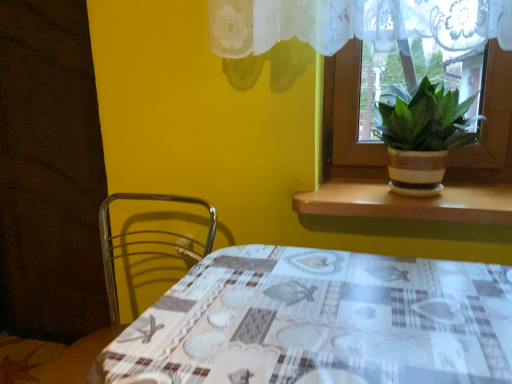
Question: Considering the relative sizes of metallic wire chair at lower left and brown wood at upper right in the image provided, is metallic wire chair at lower left taller than brown wood at upper right?

Choices:
 (A) yes
 (B) no

Answer: (A)

Question: Considering the relative positions of metallic wire chair at lower left and brown wood at upper right in the image provided, is metallic wire chair at lower left to the right of brown wood at upper right from the viewer's perspective?

Choices:
 (A) no
 (B) yes

Answer: (A)

Question: Is metallic wire chair at lower left facing away from brown wood at upper right?

Choices:
 (A) no
 (B) yes

Answer: (A)

Question: From the image's perspective, is metallic wire chair at lower left below brown wood at upper right?

Choices:
 (A) no
 (B) yes

Answer: (B)

Question: Is metallic wire chair at lower left facing towards brown wood at upper right?

Choices:
 (A) yes
 (B) no

Answer: (B)

Question: Does metallic wire chair at lower left come in front of brown wood at upper right?

Choices:
 (A) no
 (B) yes

Answer: (B)

Question: Does brown wood at upper right have a greater height compared to plaid fabric table at center?

Choices:
 (A) yes
 (B) no

Answer: (B)

Question: Considering the relative positions of brown wood at upper right and plaid fabric table at center in the image provided, is brown wood at upper right in front of plaid fabric table at center?

Choices:
 (A) yes
 (B) no

Answer: (B)

Question: From the image's perspective, is brown wood at upper right beneath plaid fabric table at center?

Choices:
 (A) yes
 (B) no

Answer: (B)

Question: Could you tell me if brown wood at upper right is facing plaid fabric table at center?

Choices:
 (A) no
 (B) yes

Answer: (A)

Question: Considering the relative sizes of brown wood at upper right and plaid fabric table at center in the image provided, is brown wood at upper right wider than plaid fabric table at center?

Choices:
 (A) no
 (B) yes

Answer: (A)

Question: From the image's perspective, is brown wood at upper right over plaid fabric table at center?

Choices:
 (A) yes
 (B) no

Answer: (A)

Question: Does brown wood at upper right contain metallic wire chair at lower left?

Choices:
 (A) no
 (B) yes

Answer: (A)